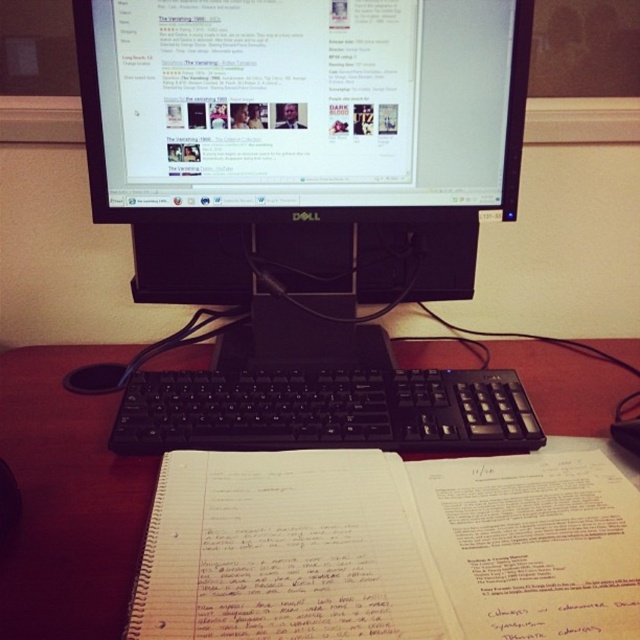
Question: Estimate the real-world distances between objects in this image. Which object is farther from the black plastic monitor at center?

Choices:
 (A) black matte monitor at upper center
 (B) black plastic keyboard at center
 (C) wooden at center
 (D) black plastic mouse at lower left

Answer: (D)

Question: Is wooden at center to the left of black plastic keyboard at center from the viewer's perspective?

Choices:
 (A) no
 (B) yes

Answer: (B)

Question: Does black plastic monitor at center have a lesser width compared to black matte monitor at upper center?

Choices:
 (A) no
 (B) yes

Answer: (B)

Question: Which is farther from the black plastic mouse at lower left?

Choices:
 (A) black plastic monitor at center
 (B) wooden at center

Answer: (A)

Question: Considering the real-world distances, which object is farthest from the black plastic mouse at lower left?

Choices:
 (A) black plastic keyboard at center
 (B) wooden at center
 (C) black plastic monitor at center

Answer: (C)

Question: Is black plastic monitor at center smaller than black matte monitor at upper center?

Choices:
 (A) no
 (B) yes

Answer: (A)